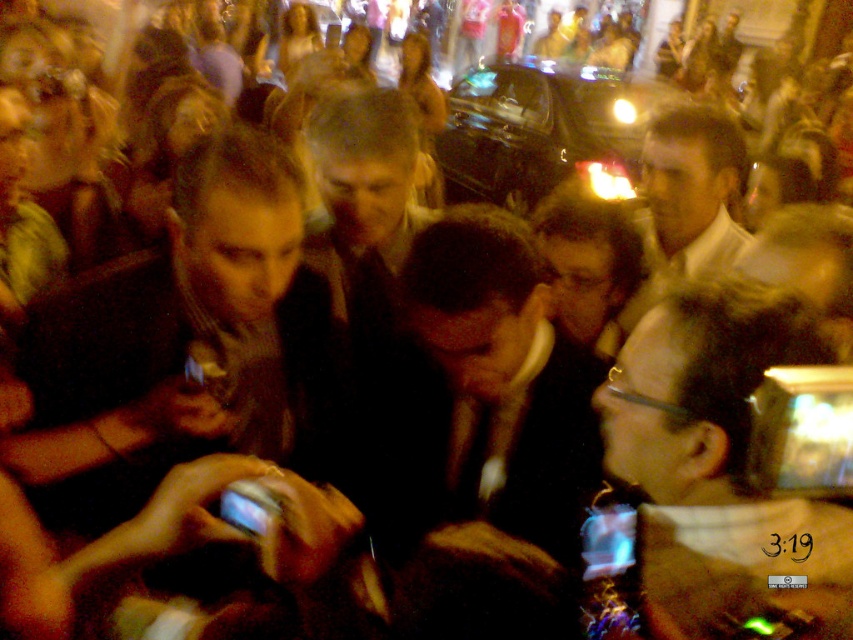
Consider the image. You are at an event and want to take a photo with your clear plastic phone at right. However, there is a matte white shirt at center blocking your view. Can you adjust your position to take the photo without moving the shirt?

The clear plastic phone at right is positioned under the matte white shirt at center, so you can lower your phone or adjust your angle to take the photo without moving the shirt.

You are standing at the origin of the coordinate system in this crowded scene. You notice two points marked in the image. The first point is at coordinates point (86, 416) and the second is at point (840, 589). Which point is closer to you?

Point (86, 416) is behind point (840, 589), so the closer point to you is point (840, 589).

You are at an event and want to take a photo of the matte white shirt at center without the dark brown leather jacket at left blocking the view. Is the jacket currently blocking the shirt?

Yes, the dark brown leather jacket at left is in front of the matte white shirt at center, so it is blocking the view of the shirt.